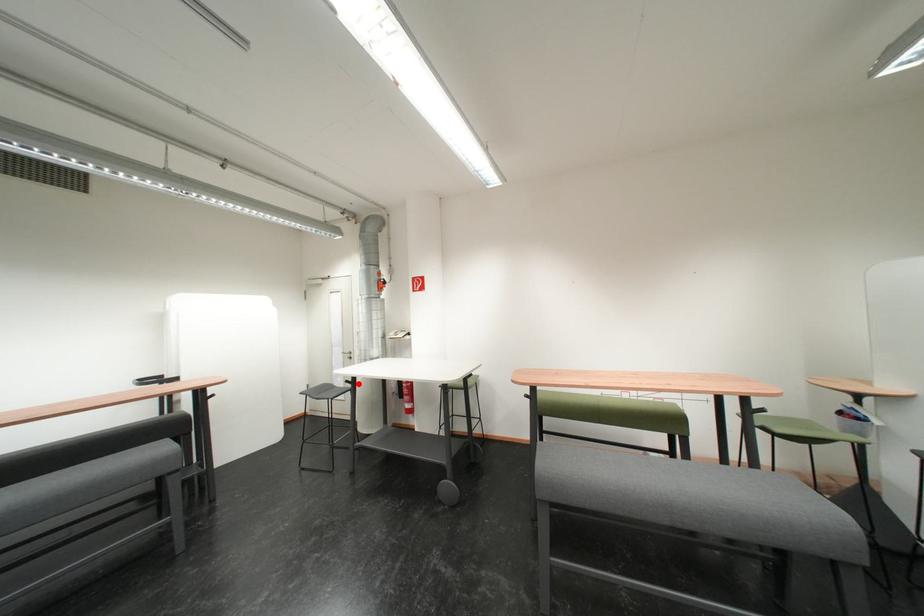
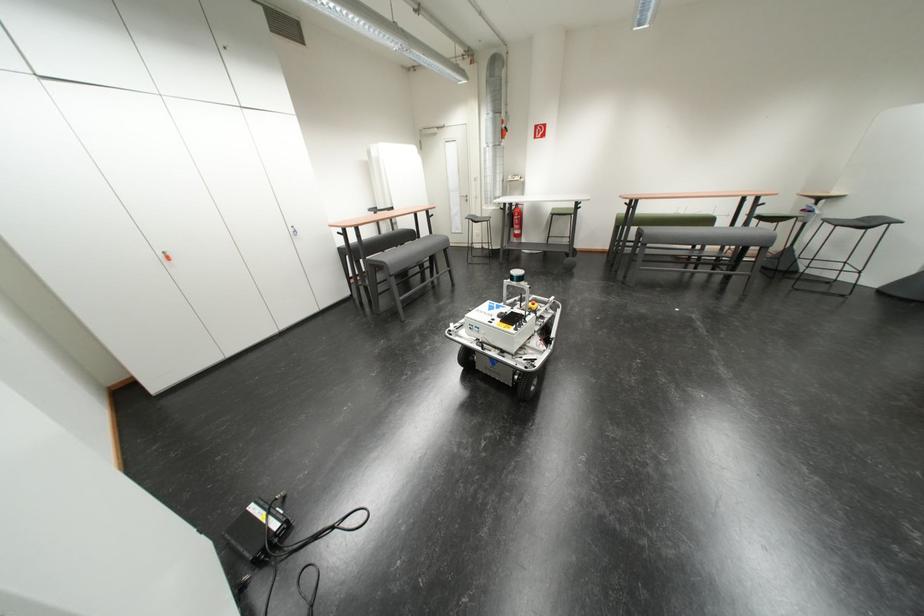
Where in the second image is the point corresponding to the highlighted location from the first image?

(512, 211)